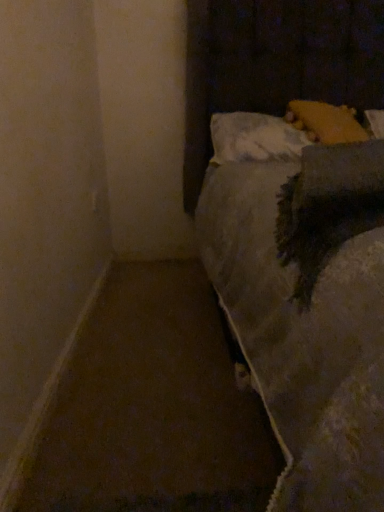
In order to face white soft pillow at upper right, should I rotate leftwards or rightwards?

Turn right approximately 12.168 degrees to face it.

Locate an element on the screen. white soft pillow at upper right is located at coordinates (254, 138).

Image resolution: width=384 pixels, height=512 pixels. Describe the element at coordinates (254, 138) in the screenshot. I see `white soft pillow at upper right` at that location.

I want to click on white soft pillow at upper right, so click(x=254, y=138).